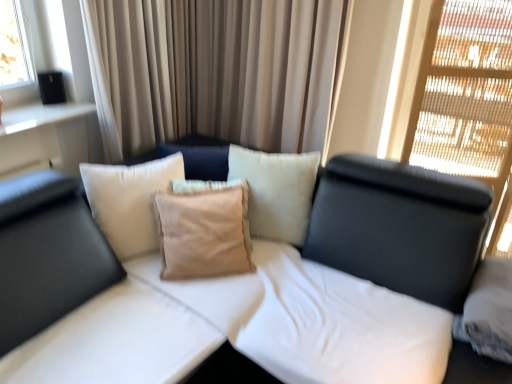
Question: Does white fabric studio couch at center have a larger size compared to suede beige pillow at center?

Choices:
 (A) yes
 (B) no

Answer: (A)

Question: Is white fabric studio couch at center far away from suede beige pillow at center?

Choices:
 (A) yes
 (B) no

Answer: (B)

Question: Can you confirm if white fabric studio couch at center is positioned to the left of suede beige pillow at center?

Choices:
 (A) no
 (B) yes

Answer: (A)

Question: Does white fabric studio couch at center have a lesser width compared to suede beige pillow at center?

Choices:
 (A) yes
 (B) no

Answer: (B)

Question: Is white fabric studio couch at center taller than suede beige pillow at center?

Choices:
 (A) yes
 (B) no

Answer: (A)

Question: Is white fabric studio couch at center further to camera compared to suede beige pillow at center?

Choices:
 (A) yes
 (B) no

Answer: (B)

Question: Can we say translucent wood screen at upper right lies outside suede beige pillow at center?

Choices:
 (A) yes
 (B) no

Answer: (A)

Question: Considering the relative sizes of translucent wood screen at upper right and suede beige pillow at center in the image provided, is translucent wood screen at upper right wider than suede beige pillow at center?

Choices:
 (A) no
 (B) yes

Answer: (B)

Question: Is translucent wood screen at upper right at the left side of suede beige pillow at center?

Choices:
 (A) yes
 (B) no

Answer: (B)

Question: Can you confirm if translucent wood screen at upper right is thinner than suede beige pillow at center?

Choices:
 (A) no
 (B) yes

Answer: (A)

Question: Is translucent wood screen at upper right smaller than suede beige pillow at center?

Choices:
 (A) no
 (B) yes

Answer: (A)

Question: Is translucent wood screen at upper right looking in the opposite direction of suede beige pillow at center?

Choices:
 (A) yes
 (B) no

Answer: (B)

Question: Is suede beige pillow at center positioned in front of translucent wood screen at upper right?

Choices:
 (A) yes
 (B) no

Answer: (B)